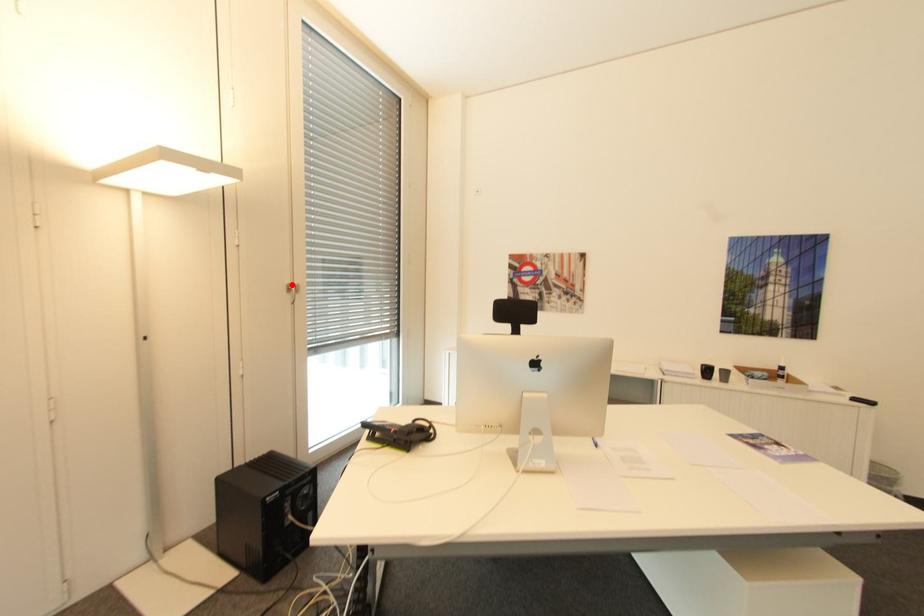
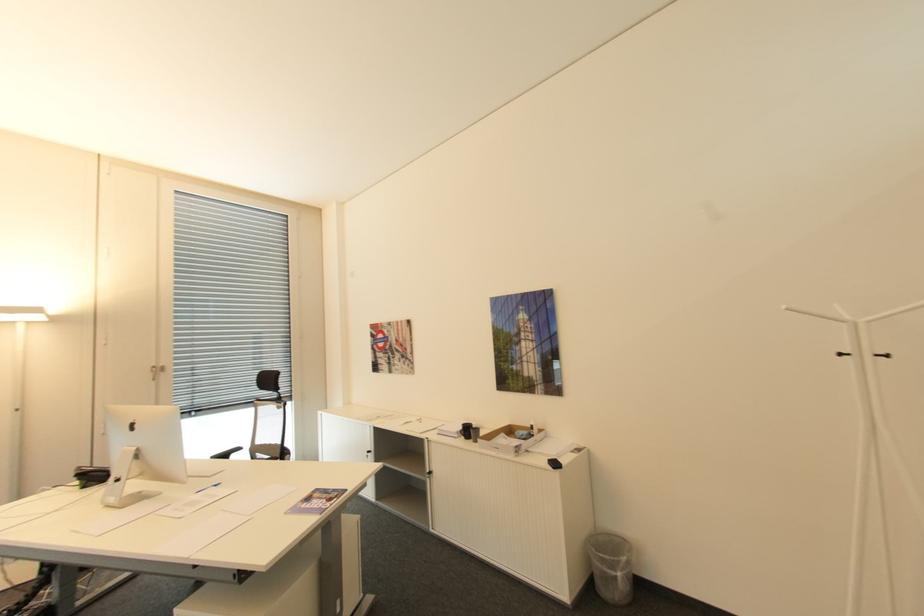
Locate, in the second image, the point that corresponds to the highlighted location in the first image.

(159, 367)